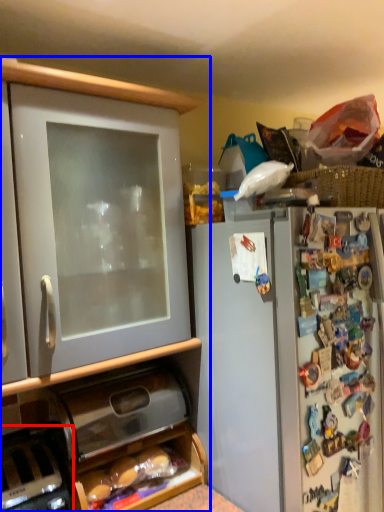
Question: Which point is further to the camera, appliance (highlighted by a red box) or cabinetry (highlighted by a blue box)?

Choices:
 (A) appliance
 (B) cabinetry

Answer: (A)